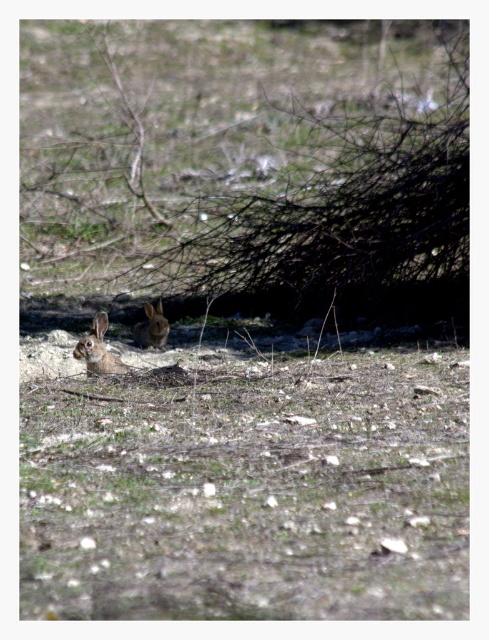
You are a photographer trying to capture a closeup of the rabbits in the scene. You notice two points marked in the image. Which point is closer to your camera lens, point (460, 104) or point (99, 353)?

Point (460, 104) is further to the viewer than point (99, 353), so the point closer to your camera lens is point (99, 353).

In the serene woodland scene, you notice a brown textured tree at center and brown grass at lower center. Which object is taller?

The brown textured tree at center is taller than the brown grass at lower center.

You are a wildlife photographer trying to capture both rabbits in a single photo. Since your camera frame can only include the center area, will you be able to see both the furry brown rabbit at lower left and the brown furry rabbit at center in your viewfinder?

The furry brown rabbit at lower left is to the left of the brown furry rabbit at center. Since the camera frame includes the center area, the brown furry rabbit at center will be visible, but the furry brown rabbit at lower left may be outside the frame depending on its position relative to the center. However, the description does not specify the exact distance between them, so it is uncertain if both will fit.